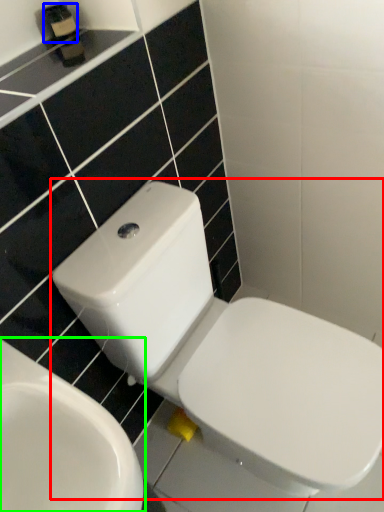
Question: Estimate the real-world distances between objects in this image. Which object is closer to toilet (highlighted by a red box), toiletry (highlighted by a blue box) or toilet (highlighted by a green box)?

Choices:
 (A) toiletry
 (B) toilet

Answer: (B)